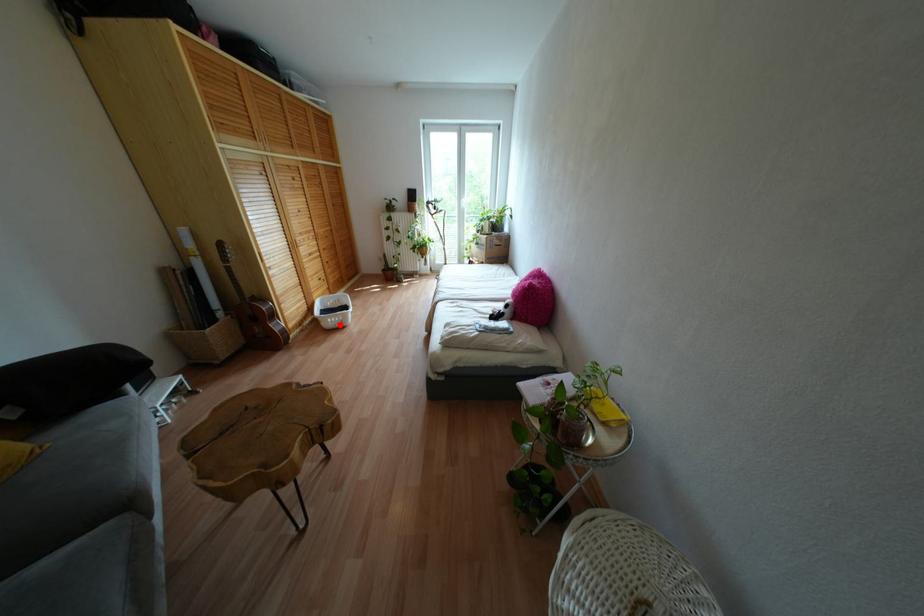
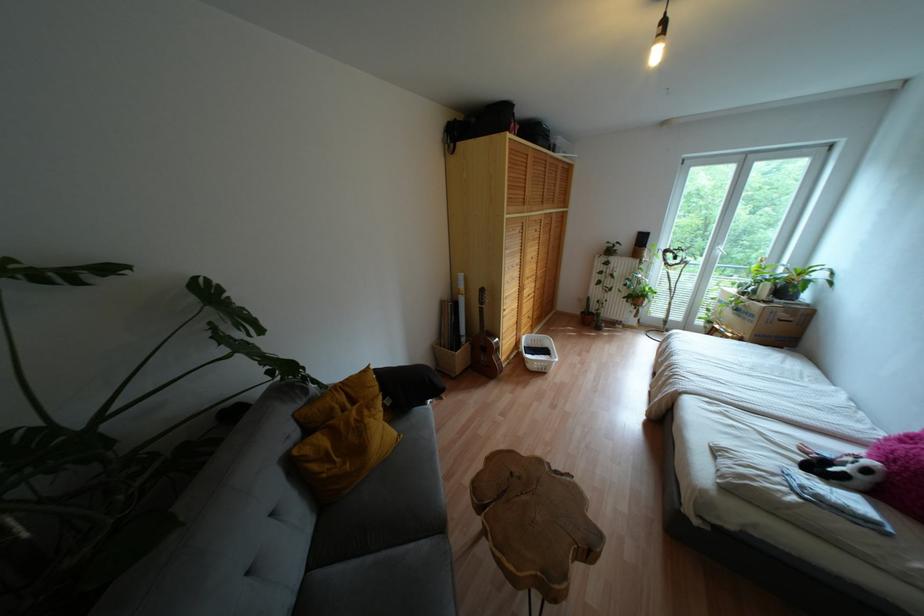
Question: I am providing you with two images of the same scene from different viewpoints. A red point is shown in image1. For the corresponding object point in image2, is it positioned nearer or farther from the camera?

Choices:
 (A) Nearer
 (B) Farther

Answer: (B)